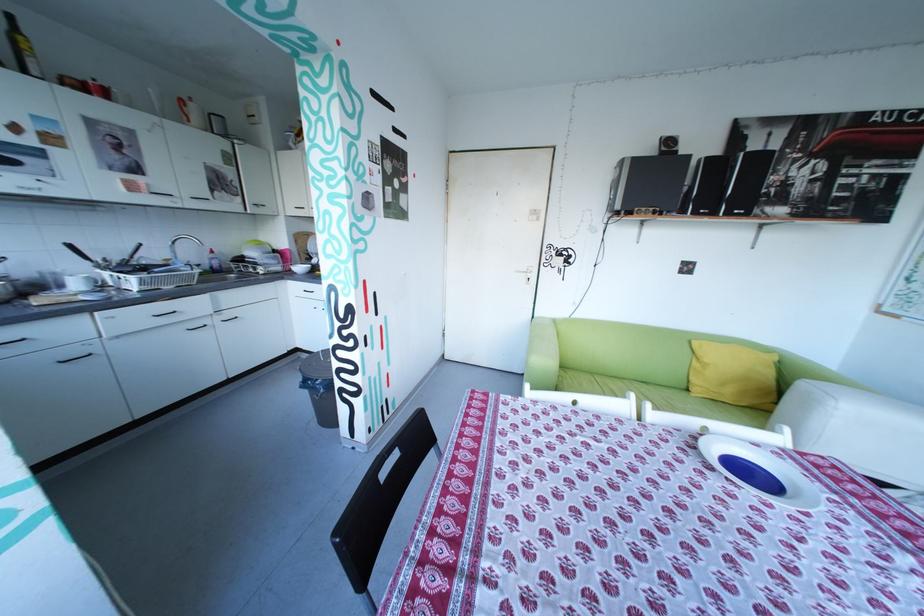
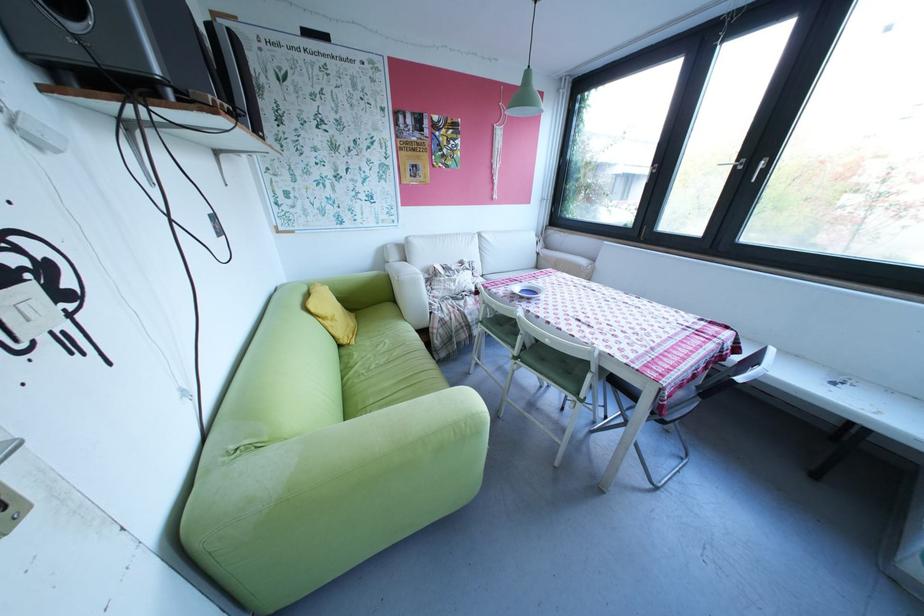
Where in the second image is the point corresponding to the point at 706,394 from the first image?

(366, 342)